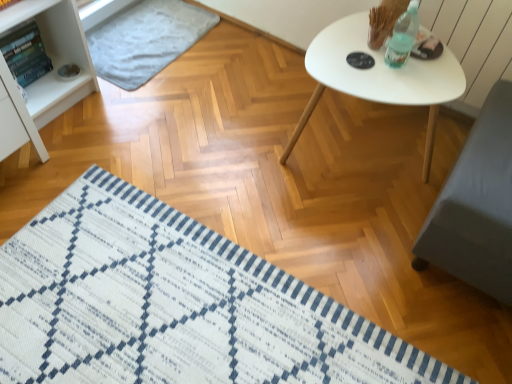
Locate an element on the screen. The image size is (512, 384). vacant location behind white woven mat at lower left, the first mat when ordered from front to back is located at coordinates (250, 148).